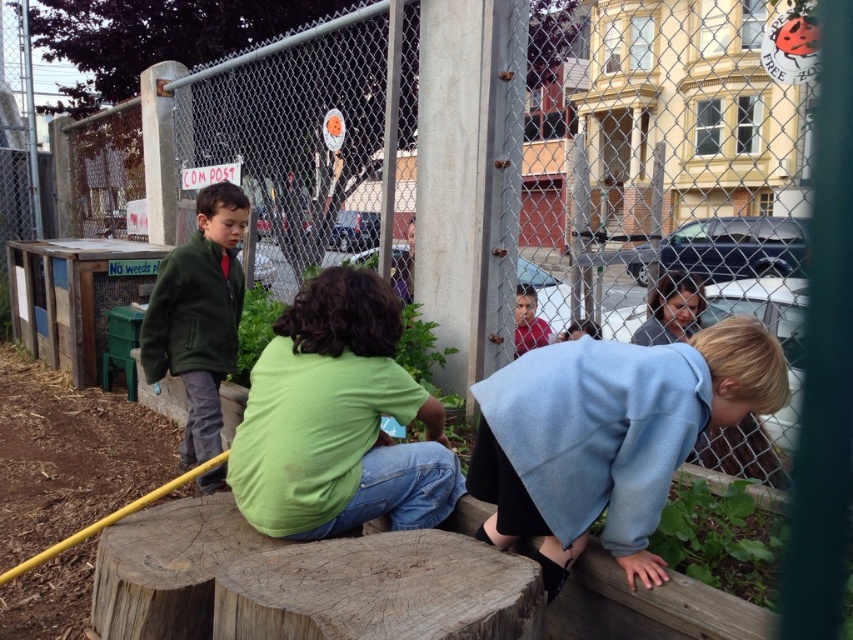
You are a parent trying to locate your child in the community garden. Your child is wearing a green matte shirt at center and another child is wearing a green fuzzy jacket at left. If you are standing at the fence, which child is closer to you?

The green fuzzy jacket at left is closer to you because the distance between the green matte shirt at center and green fuzzy jacket at left is 1.26 meters, implying the fuzzy jacket is nearer to the fence where you are standing.

You are a parent trying to locate your child in the community garden. You see the green matte shirt at center and another child leaning over the edge of the fence. How far apart are these two children?

The two children are 7.56 feet apart.